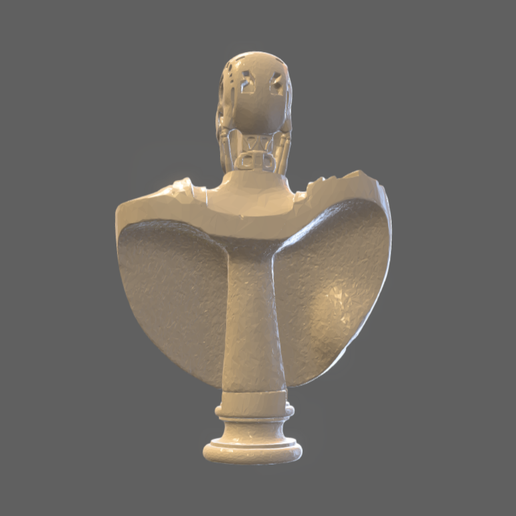
Find the location of `sculpture`. sculpture is located at coordinates (256, 236).